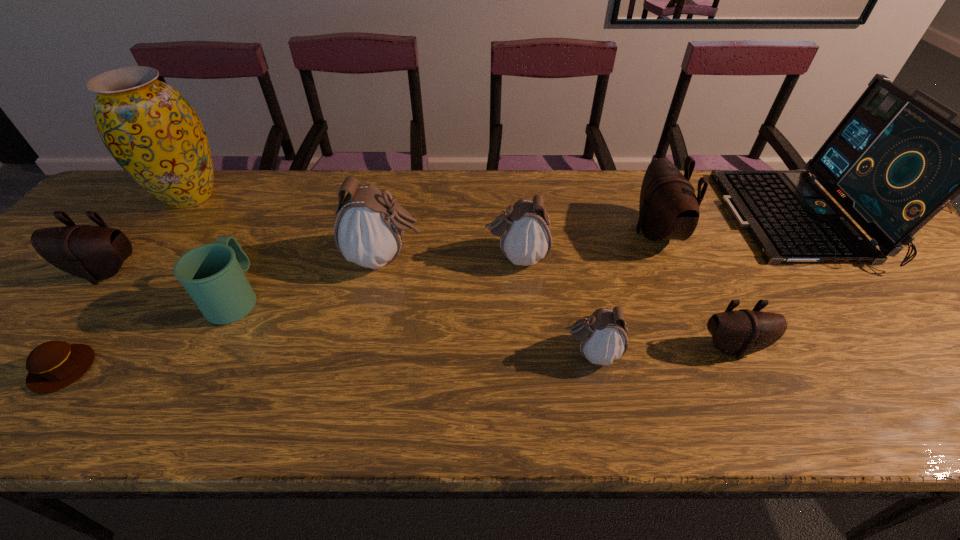
Locate an element on the screen. vase is located at coordinates (150, 129).

At what (x,y) coordinates should I click in order to perform the action: click on the rightmost object. Please return your answer as a coordinate pair (x, y). Looking at the image, I should click on (893, 163).

You are a GUI agent. You are given a task and a screenshot of the screen. Output one action in this format:
    pyautogui.click(x=<x>, y=<y>)
    Task: Click on the biggest white pouch
    
    Given the screenshot: What is the action you would take?
    pyautogui.click(x=369, y=229)

Find the location of a particular element. The image size is (960, 540). the fifth pouch from right to left is located at coordinates click(369, 229).

This screenshot has height=540, width=960. I want to click on the biggest brown pouch, so click(668, 209).

The height and width of the screenshot is (540, 960). Find the location of `the second biggest white pouch`. the second biggest white pouch is located at coordinates (524, 229).

Image resolution: width=960 pixels, height=540 pixels. What are the coordinates of `the leftmost pouch` in the screenshot? It's located at (94, 253).

At what (x,y) coordinates should I click in order to perform the action: click on the second biggest brown pouch. Please return your answer as a coordinate pair (x, y). Image resolution: width=960 pixels, height=540 pixels. Looking at the image, I should click on (94, 253).

Identify the location of green mug. The image size is (960, 540). (213, 274).

At what (x,y) coordinates should I click in order to perform the action: click on the seventh object from right to left. Please return your answer as a coordinate pair (x, y). Looking at the image, I should click on (213, 274).